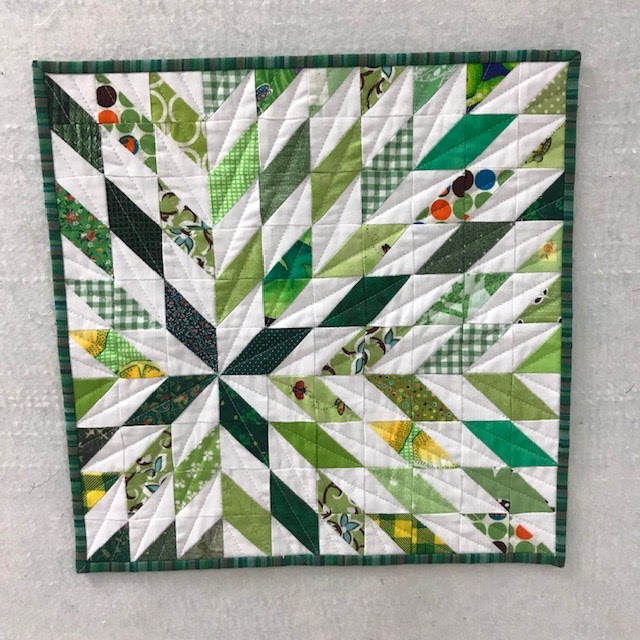
Where is `quilt`? Image resolution: width=640 pixels, height=640 pixels. quilt is located at coordinates (333, 329).